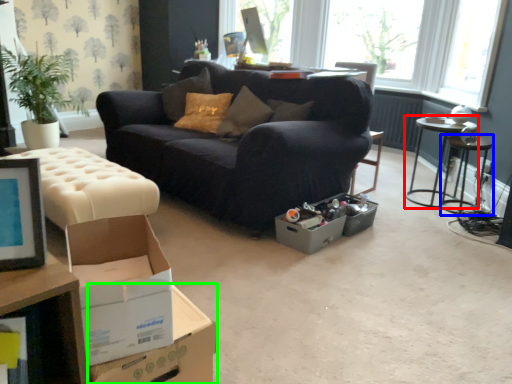
Question: Which is nearer to the table (highlighted by a red box)? side table (highlighted by a blue box) or cardboard box (highlighted by a green box).

Choices:
 (A) side table
 (B) cardboard box

Answer: (A)